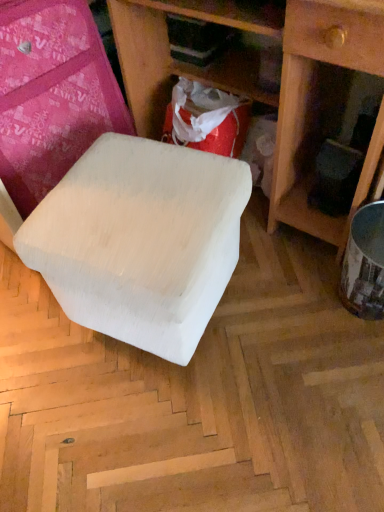
Find the location of a particular element. Image resolution: width=384 pixels, height=512 pixels. free point in front of white matte stool at center is located at coordinates (165, 432).